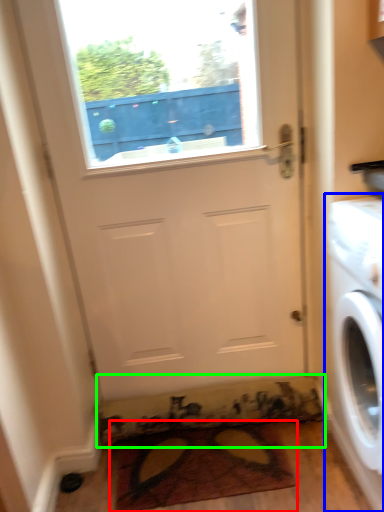
Question: Considering the real-world distances, which object is farthest from doormat (highlighted by a red box)? washing machine (highlighted by a blue box) or doormat (highlighted by a green box)?

Choices:
 (A) washing machine
 (B) doormat

Answer: (A)